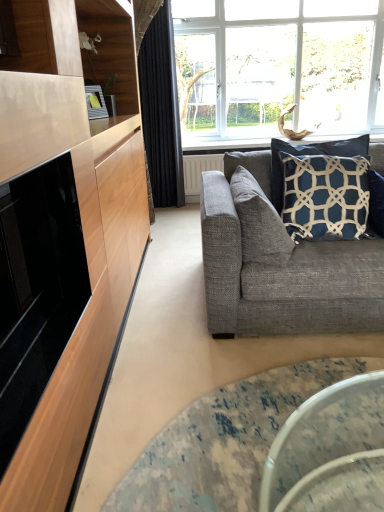
Question: Considering the relative sizes of textured gray couch at right and black velvet curtain at upper center in the image provided, is textured gray couch at right taller than black velvet curtain at upper center?

Choices:
 (A) yes
 (B) no

Answer: (B)

Question: Is textured gray couch at right smaller than black velvet curtain at upper center?

Choices:
 (A) no
 (B) yes

Answer: (A)

Question: From the image's perspective, is textured gray couch at right beneath black velvet curtain at upper center?

Choices:
 (A) no
 (B) yes

Answer: (B)

Question: From a real-world perspective, is textured gray couch at right under black velvet curtain at upper center?

Choices:
 (A) yes
 (B) no

Answer: (A)

Question: Is textured gray couch at right positioned with its back to black velvet curtain at upper center?

Choices:
 (A) yes
 (B) no

Answer: (A)

Question: Looking at their shapes, would you say black velvet curtain at upper center is wider or thinner than textured gray couch at right?

Choices:
 (A) thin
 (B) wide

Answer: (A)

Question: Considering the relative positions of black velvet curtain at upper center and textured gray couch at right in the image provided, is black velvet curtain at upper center to the left or to the right of textured gray couch at right?

Choices:
 (A) right
 (B) left

Answer: (B)

Question: From the image's perspective, is black velvet curtain at upper center above or below textured gray couch at right?

Choices:
 (A) below
 (B) above

Answer: (B)

Question: Do you think black velvet curtain at upper center is within textured gray couch at right, or outside of it?

Choices:
 (A) outside
 (B) inside

Answer: (A)

Question: From their relative heights in the image, would you say black velvet curtain at upper center is taller or shorter than navy blue fabric pillow at upper right, arranged as the 1th pillow when viewed from the right?

Choices:
 (A) short
 (B) tall

Answer: (B)

Question: From the image's perspective, is black velvet curtain at upper center positioned above or below navy blue fabric pillow at upper right, arranged as the 1th pillow when viewed from the right?

Choices:
 (A) below
 (B) above

Answer: (B)

Question: From a real-world perspective, is black velvet curtain at upper center positioned above or below navy blue fabric pillow at upper right, arranged as the 1th pillow when viewed from the right?

Choices:
 (A) above
 (B) below

Answer: (A)

Question: Would you say black velvet curtain at upper center is to the left or to the right of navy blue fabric pillow at upper right, arranged as the 1th pillow when viewed from the right, in the picture?

Choices:
 (A) right
 (B) left

Answer: (B)

Question: Relative to textured gray pillow at right, the second pillow in the right-to-left sequence, is black velvet curtain at upper center in front or behind?

Choices:
 (A) front
 (B) behind

Answer: (B)

Question: Based on their positions, is black velvet curtain at upper center located to the left or right of textured gray pillow at right, the second pillow in the right-to-left sequence?

Choices:
 (A) right
 (B) left

Answer: (B)